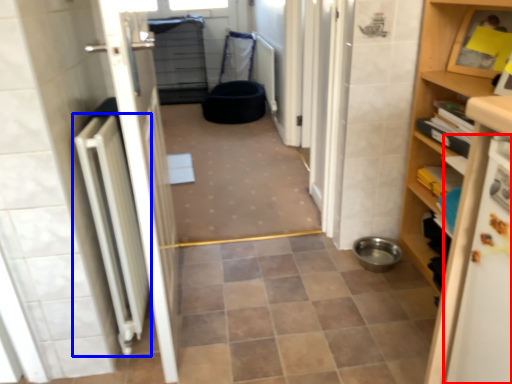
Question: Which object is closer to the camera taking this photo, appliance (highlighted by a red box) or radiator (highlighted by a blue box)?

Choices:
 (A) appliance
 (B) radiator

Answer: (A)